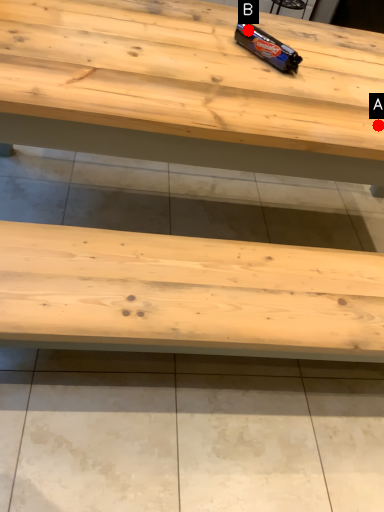
Question: Two points are circled on the image, labeled by A and B beside each circle. Among these points, which one is nearest to the camera?

Choices:
 (A) A is closer
 (B) B is closer

Answer: (A)